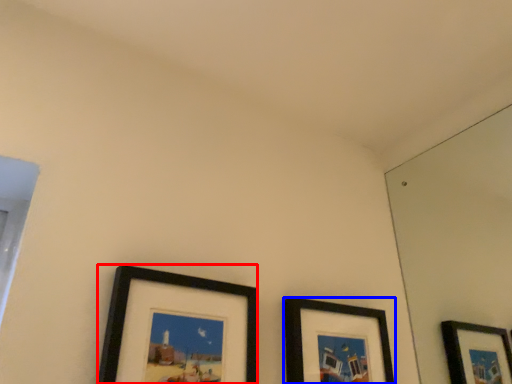
Question: Which point is closer to the camera, picture frame (highlighted by a red box) or picture frame (highlighted by a blue box)?

Choices:
 (A) picture frame
 (B) picture frame

Answer: (A)